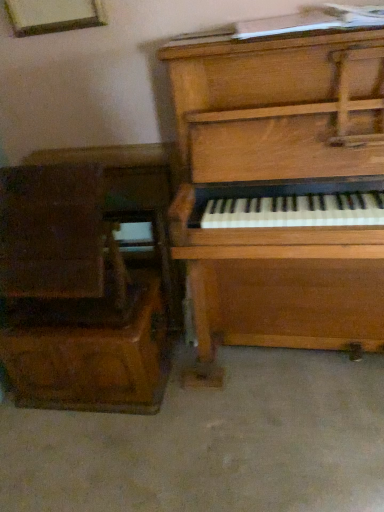
This screenshot has width=384, height=512. In order to click on vacant space to the right of wooden drawer at left in this screenshot , I will do `click(216, 391)`.